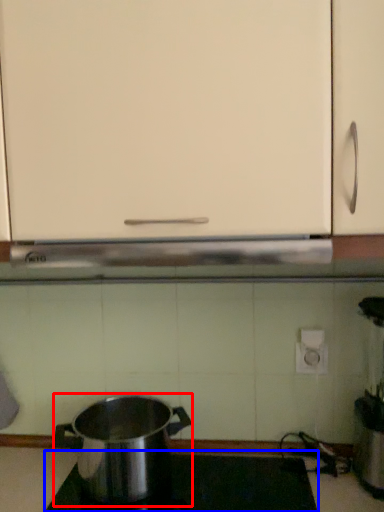
Question: Which object appears farthest to the camera in this image, kitchen appliance (highlighted by a red box) or gas stove (highlighted by a blue box)?

Choices:
 (A) kitchen appliance
 (B) gas stove

Answer: (A)